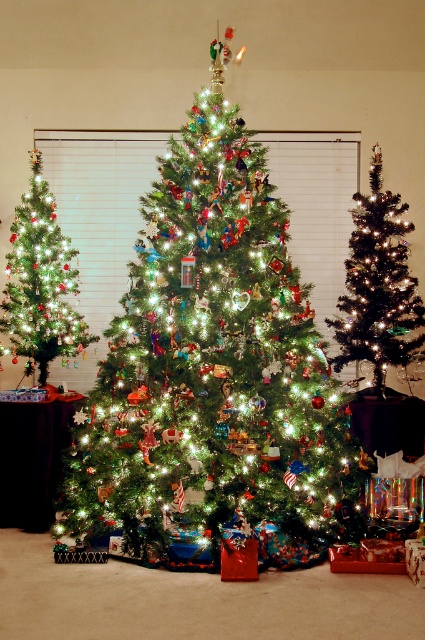
You are a guest at a Christmas party and want to place a new decoration on the tallest object between the iridescent glass ornaments at center and the shiny silver christmas tree at center. Which object should you choose?

The iridescent glass ornaments at center has a greater height compared to the shiny silver christmas tree at center, so you should place the decoration on the iridescent glass ornaments at center.

You are a guest at a Christmas party and want to place a new decoration on the highest point of the green matte christmas tree at left without touching the iridescent glass ornaments at center. Is this possible?

The iridescent glass ornaments at center is below the green matte christmas tree at left, so yes, you can place the decoration on the highest point of the green matte christmas tree at left without disturbing the ornaments.